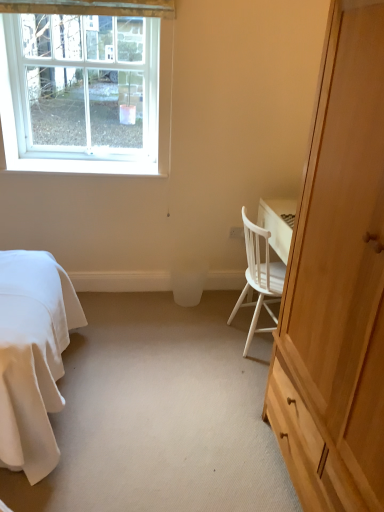
Question: From a real-world perspective, is white plastic power outlet at center physically below white wood chair at right?

Choices:
 (A) yes
 (B) no

Answer: (B)

Question: From the image's perspective, does white plastic power outlet at center appear lower than white wood chair at right?

Choices:
 (A) no
 (B) yes

Answer: (A)

Question: From the image's perspective, does white plastic power outlet at center appear higher than white wood chair at right?

Choices:
 (A) yes
 (B) no

Answer: (A)

Question: Is white plastic power outlet at center to the left of white wood chair at right from the viewer's perspective?

Choices:
 (A) no
 (B) yes

Answer: (B)

Question: Is white plastic power outlet at center oriented away from white wood chair at right?

Choices:
 (A) no
 (B) yes

Answer: (A)

Question: Is point (1, 93) closer or farther from the camera than point (276, 279)?

Choices:
 (A) closer
 (B) farther

Answer: (B)

Question: From a real-world perspective, is white plastic window at upper left physically located above or below white wood chair at right?

Choices:
 (A) above
 (B) below

Answer: (A)

Question: Is white plastic window at upper left taller or shorter than white wood chair at right?

Choices:
 (A) tall
 (B) short

Answer: (A)

Question: In terms of size, does white plastic window at upper left appear bigger or smaller than white wood chair at right?

Choices:
 (A) small
 (B) big

Answer: (A)

Question: Considering the positions of white plastic window at upper left and white plastic trash bin/can at center in the image, is white plastic window at upper left taller or shorter than white plastic trash bin/can at center?

Choices:
 (A) tall
 (B) short

Answer: (A)

Question: From a real-world perspective, is white plastic window at upper left above or below white plastic trash bin/can at center?

Choices:
 (A) below
 (B) above

Answer: (B)

Question: Is white plastic window at upper left wider or thinner than white plastic trash bin/can at center?

Choices:
 (A) thin
 (B) wide

Answer: (A)

Question: Would you say white plastic window at upper left is to the left or to the right of white plastic trash bin/can at center in the picture?

Choices:
 (A) right
 (B) left

Answer: (B)

Question: From a real-world perspective, is white plastic window at upper left physically located above or below light wood cabinet at right?

Choices:
 (A) above
 (B) below

Answer: (A)

Question: Is white plastic window at upper left taller or shorter than light wood cabinet at right?

Choices:
 (A) tall
 (B) short

Answer: (B)